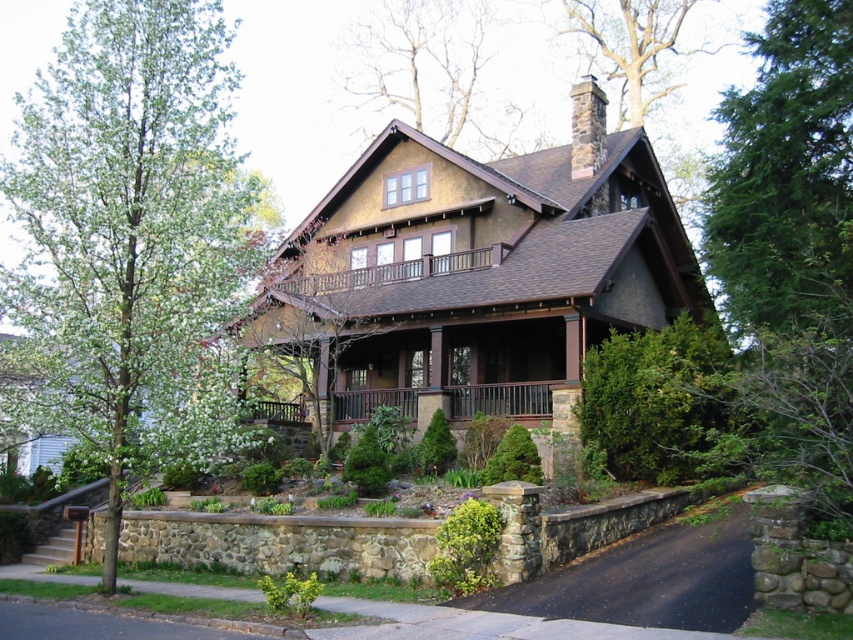
Does green leafy tree at left have a lesser width compared to green leafy tree at center?

In fact, green leafy tree at left might be wider than green leafy tree at center.

Which is below, green leafy tree at left or green leafy tree at center?

Positioned lower is green leafy tree at center.

Locate an element on the screen. The height and width of the screenshot is (640, 853). green leafy tree at left is located at coordinates (135, 234).

Between green leafy tree at upper right and bare branches at upper center, which one has more height?

bare branches at upper center is taller.

Which is more to the right, green leafy tree at upper right or bare branches at upper center?

Positioned to the right is green leafy tree at upper right.

Locate an element on the screen. This screenshot has width=853, height=640. green leafy tree at upper right is located at coordinates (785, 172).

Who is positioned more to the left, bare branches at upper center or green leafy tree at center?

green leafy tree at center

Does point (491, 116) come farther from viewer compared to point (326, 284)?

That is True.

Where is `bare branches at upper center`? The image size is (853, 640). bare branches at upper center is located at coordinates (431, 72).